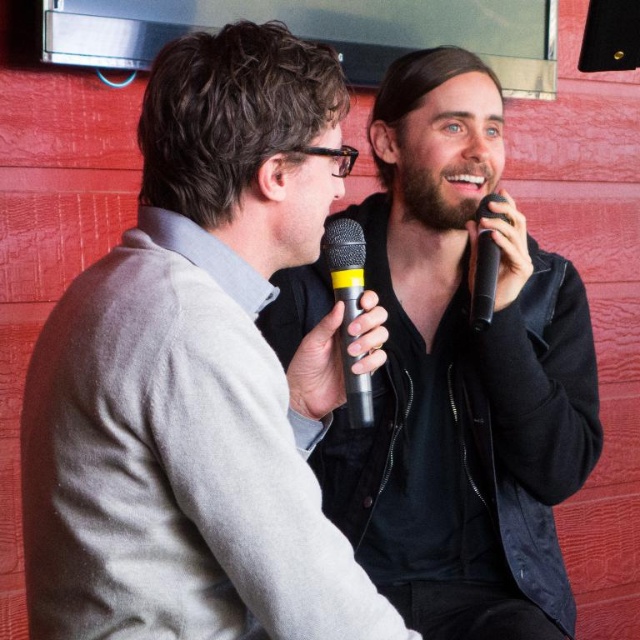
Question: Among these points, which one is nearest to the camera?

Choices:
 (A) (378, 584)
 (B) (352, 230)

Answer: (B)

Question: Which object is positioned closest to the gray wool sweater at left?

Choices:
 (A) matte black jacket at center
 (B) black matte microphone at right

Answer: (A)

Question: From the image, what is the correct spatial relationship of gray wool sweater at left in relation to matte black jacket at center?

Choices:
 (A) below
 (B) above

Answer: (B)

Question: Can you confirm if gray wool sweater at left is positioned to the right of matte black jacket at center?

Choices:
 (A) no
 (B) yes

Answer: (A)

Question: Which object is closer to the camera taking this photo?

Choices:
 (A) black rubber microphone at center
 (B) black matte microphone at right

Answer: (A)

Question: Is gray wool sweater at left to the left of matte black jacket at center from the viewer's perspective?

Choices:
 (A) yes
 (B) no

Answer: (A)